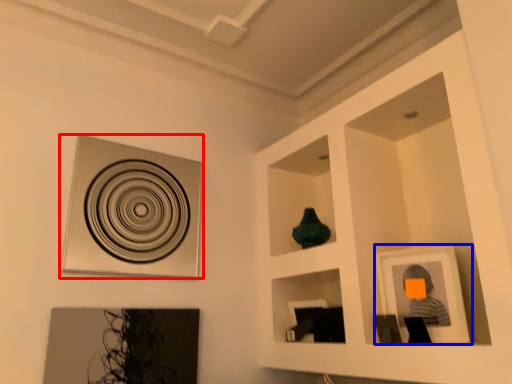
Question: Which object is closer to the camera taking this photo, picture frame (highlighted by a red box) or picture frame (highlighted by a blue box)?

Choices:
 (A) picture frame
 (B) picture frame

Answer: (B)